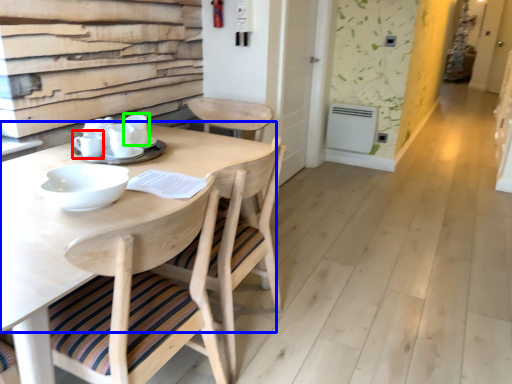
Question: Which is farther away from tableware (highlighted by a red box)? round table (highlighted by a blue box) or tableware (highlighted by a green box)?

Choices:
 (A) round table
 (B) tableware

Answer: (A)